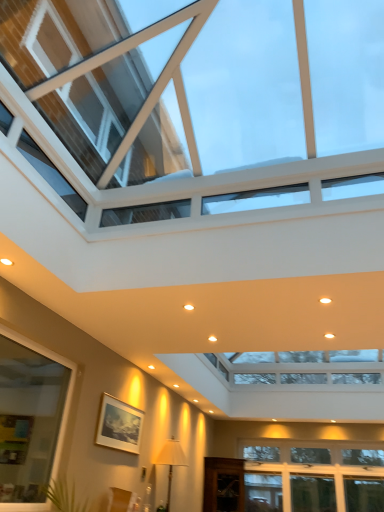
Question: Is clear glass window at lower left, the 2th window when ordered from bottom to top, closer to camera compared to transparent glass window at upper center, placed as the 3th window when sorted from bottom to top?

Choices:
 (A) yes
 (B) no

Answer: (B)

Question: From a real-world perspective, is clear glass window at lower left, the 2th window when ordered from bottom to top, positioned under transparent glass window at upper center, which ranks as the first window in top-to-bottom order, based on gravity?

Choices:
 (A) no
 (B) yes

Answer: (B)

Question: Considering the relative sizes of clear glass window at lower left, the 2th window from the top, and transparent glass window at upper center, which ranks as the first window in top-to-bottom order, in the image provided, is clear glass window at lower left, the 2th window from the top, taller than transparent glass window at upper center, which ranks as the first window in top-to-bottom order,?

Choices:
 (A) yes
 (B) no

Answer: (A)

Question: Considering the relative sizes of clear glass window at lower left, the 2th window from the top, and transparent glass window at upper center, which ranks as the first window in top-to-bottom order, in the image provided, is clear glass window at lower left, the 2th window from the top, thinner than transparent glass window at upper center, which ranks as the first window in top-to-bottom order,?

Choices:
 (A) no
 (B) yes

Answer: (B)

Question: Is clear glass window at lower left, the 2th window from the top, turned away from transparent glass window at upper center, placed as the 3th window when sorted from bottom to top?

Choices:
 (A) yes
 (B) no

Answer: (B)

Question: Is clear glass window at lower left, the 2th window from the top, shorter than transparent glass window at upper center, which ranks as the first window in top-to-bottom order?

Choices:
 (A) no
 (B) yes

Answer: (A)

Question: Does clear glass window at lower left, the 2th window from the top, appear on the right side of white fabric lampshade at lower center?

Choices:
 (A) no
 (B) yes

Answer: (A)

Question: Could you tell me if clear glass window at lower left, the 2th window from the top, is turned towards white fabric lampshade at lower center?

Choices:
 (A) no
 (B) yes

Answer: (A)

Question: From a real-world perspective, is clear glass window at lower left, the 2th window when ordered from bottom to top, on white fabric lampshade at lower center?

Choices:
 (A) yes
 (B) no

Answer: (A)

Question: Is clear glass window at lower left, the 2th window when ordered from bottom to top, taller than white fabric lampshade at lower center?

Choices:
 (A) yes
 (B) no

Answer: (A)

Question: Is white fabric lampshade at lower center surrounded by clear glass window at lower left, the 2th window when ordered from bottom to top?

Choices:
 (A) yes
 (B) no

Answer: (B)

Question: From a real-world perspective, is clear glass window at lower left, the 2th window when ordered from bottom to top, below white fabric lampshade at lower center?

Choices:
 (A) yes
 (B) no

Answer: (B)

Question: Is transparent glass window at upper center, which ranks as the first window in top-to-bottom order, in front of white fabric lampshade at lower center?

Choices:
 (A) yes
 (B) no

Answer: (A)